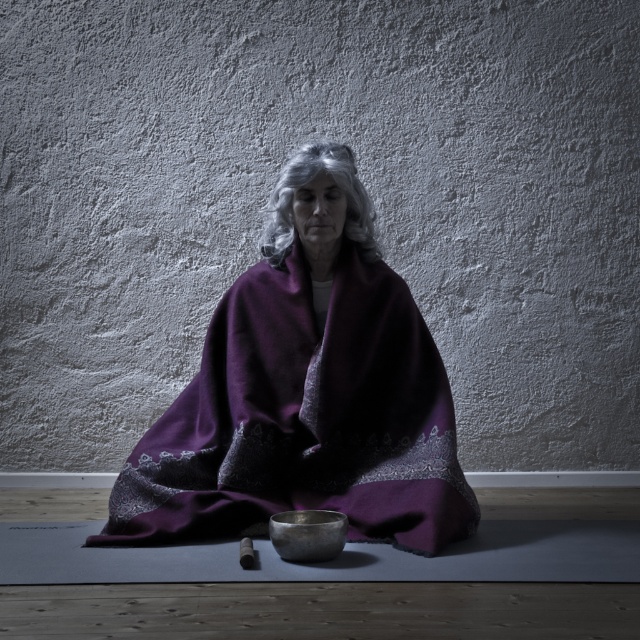
You are a photographer planning to capture the purple woolen shawl at center and the grayhair at center in a closeup shot. Based on their sizes, which object should you focus on first to ensure it fits entirely within the frame?

The purple woolen shawl at center has a larger size compared to grayhair at center, so you should focus on capturing the purple woolen shawl at center first to ensure it fits entirely within the frame.

You are a photographer positioned at the center of the room. You want to take a photo that includes both the point at coordinates point (147, 452) and point (275, 253). Which point should you focus on first to ensure both are in focus?

You should focus on point (147, 452) first because it is closer to you than point (275, 253). This way, both points will be within the depth of field.